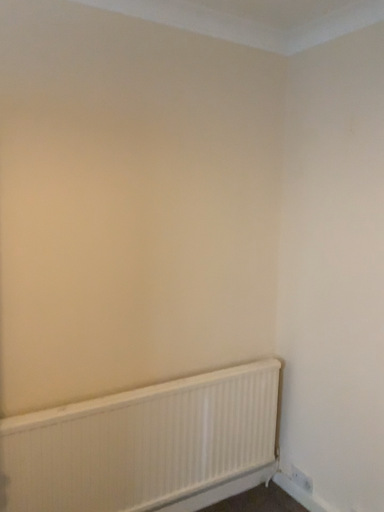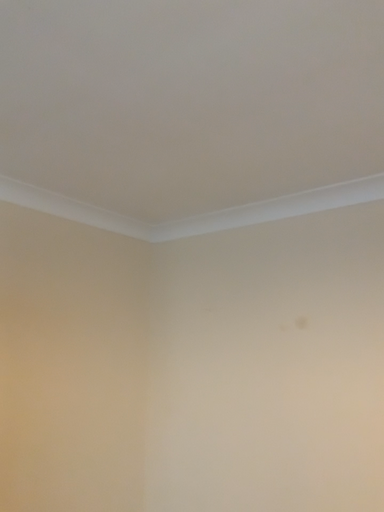
Question: How did the camera likely rotate when shooting the video?

Choices:
 (A) rotated left
 (B) rotated right

Answer: (B)